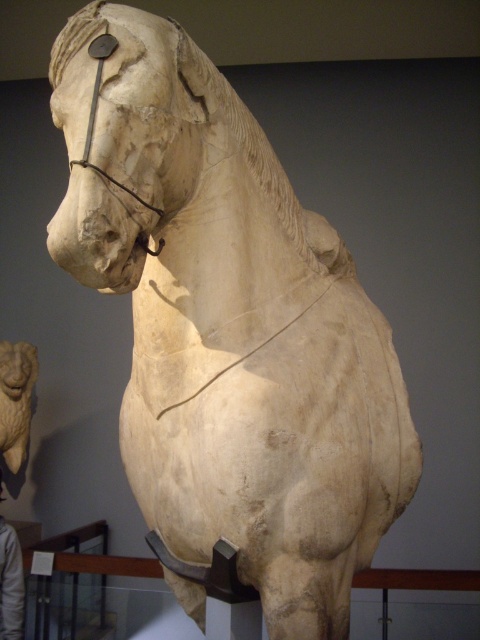
You are a visitor in the museum and want to take a photo of the light brown leather jacket at lower left without the white marble lion at upper left appearing in the frame. Is this possible given their positions?

The white marble lion at upper left is positioned on the left side of light brown leather jacket at lower left. Since they are positioned side by side horizontally, you can adjust your angle or move to the right side of the light brown leather jacket at lower left to exclude the white marble lion at upper left from the frame.

You are an art curator planning to move the white marble lion at upper left and the light brown leather jacket at lower left to a new exhibition space. The new space has a height restriction of 1.2 meters. Given their sizes, will both items fit under the height limit?

The white marble lion at upper left is smaller than the light brown leather jacket at lower left. Since the height restriction is 1.2 meters, we need to know the exact dimensions of both items. However, based on the description, the white marble lion at upper left is smaller, so it might fit, but the light brown leather jacket at lower left could exceed the height limit. Without specific measurements, it is uncertain if both will fit.

Based on the photo, you are an art student who wants to sketch the sculpture of the horse. You notice the white marble lion at upper left and the light brown leather jacket at lower left in the scene. Which object is located higher up in the image?

The white marble lion at upper left is positioned over the light brown leather jacket at lower left, so it is higher up in the image.